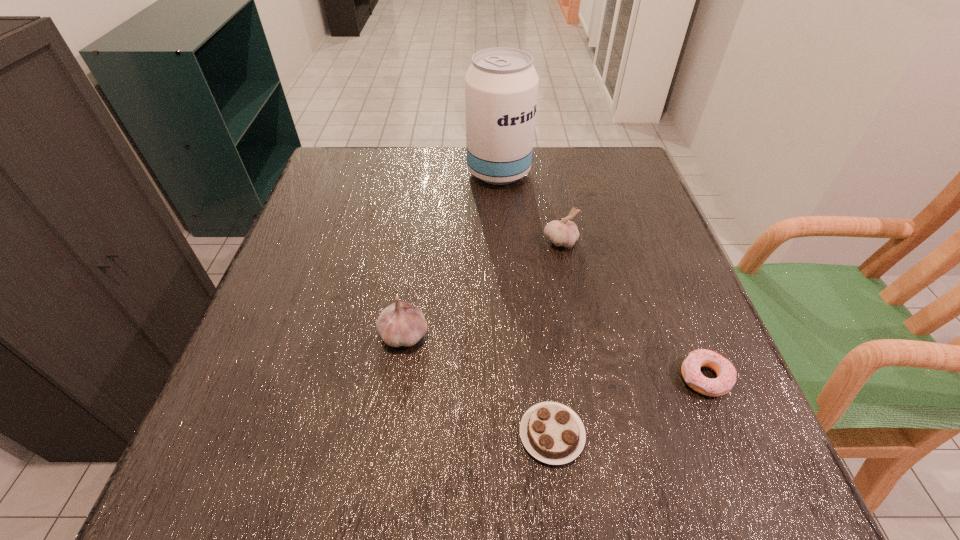
Find the location of a particular element. the tallest object is located at coordinates (501, 85).

Identify the location of the farthest object. The image size is (960, 540). (501, 85).

Where is `the nearer garlic`? The image size is (960, 540). the nearer garlic is located at coordinates (400, 324).

The width and height of the screenshot is (960, 540). I want to click on the third nearest object, so click(x=400, y=324).

I want to click on the third tallest object, so click(x=562, y=232).

Identify the location of the farther garlic. (562, 232).

This screenshot has height=540, width=960. I want to click on the second nearest object, so click(726, 373).

Where is `doughnut`? Image resolution: width=960 pixels, height=540 pixels. doughnut is located at coordinates (726, 373).

Where is `the nearest object`? This screenshot has height=540, width=960. the nearest object is located at coordinates (551, 432).

At what (x,y) coordinates should I click in order to perform the action: click on vacant region located 0.220m on the front of the tallest object. Please return your answer as a coordinate pair (x, y). The height and width of the screenshot is (540, 960). Looking at the image, I should click on (503, 249).